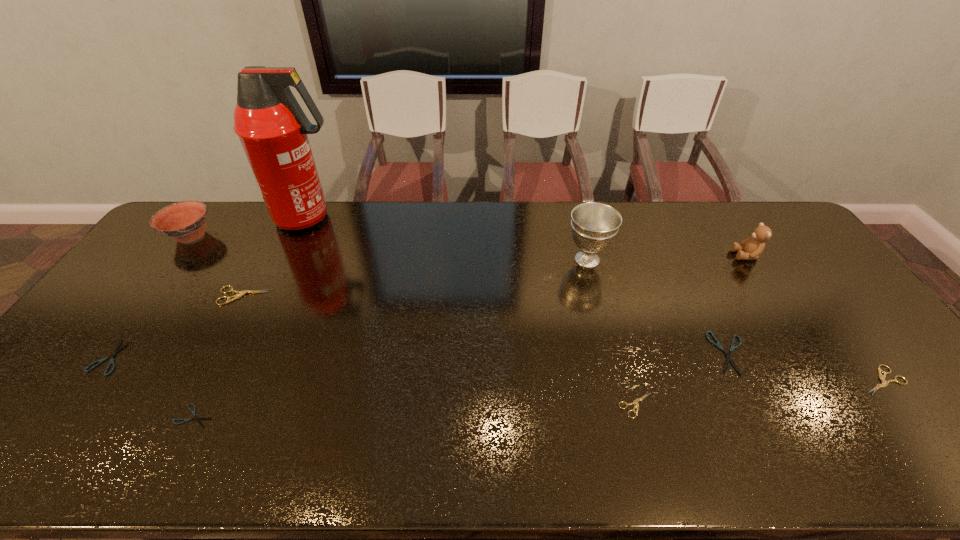
Locate an element on the screen. The height and width of the screenshot is (540, 960). free space between the second beige shears from left to right and the leftmost shears is located at coordinates (372, 381).

This screenshot has height=540, width=960. I want to click on vacant region between the second biggest black shears and the ninth shortest object, so click(x=348, y=308).

Identify the location of the seventh closest object to the nearest black shears. [728, 355].

Locate an element on the screen. This screenshot has width=960, height=540. object that can be found as the closest to the second tallest object is located at coordinates (728, 355).

Locate an element on the screen. the fifth closest shears relative to the sixth shortest object is located at coordinates (884, 383).

Choose which shears is the nearest neighbor to the second smallest beige shears. Please provide its 2D coordinates. Your answer should be formatted as a tuple, i.e. [(x, y)], where the tuple contains the x and y coordinates of a point satisfying the conditions above.

[(728, 355)]

Choose which beige shears is the third nearest neighbor to the bowl. Please provide its 2D coordinates. Your answer should be formatted as a tuple, i.e. [(x, y)], where the tuple contains the x and y coordinates of a point satisfying the conditions above.

[(884, 383)]

This screenshot has width=960, height=540. Find the location of `beige shears that can be found as the closest to the tallest shears`. beige shears that can be found as the closest to the tallest shears is located at coordinates (635, 402).

Select which black shears appears as the second closest to the shortest shears. Please provide its 2D coordinates. Your answer should be formatted as a tuple, i.e. [(x, y)], where the tuple contains the x and y coordinates of a point satisfying the conditions above.

[(728, 355)]

I want to click on black shears that is the nearest to the third tallest object, so click(728, 355).